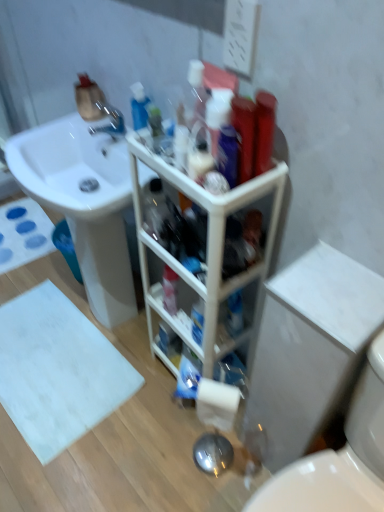
Measure the distance between white plastic cabinet at center and camera.

88.83 centimeters.

This screenshot has width=384, height=512. I want to click on white glossy toilet at lower right, so point(339,458).

At what (x,y) coordinates should I click in order to perform the action: click on white matte toilet paper at lower center. Please return your answer as a coordinate pair (x, y). The image size is (384, 512). Looking at the image, I should click on (217, 403).

This screenshot has width=384, height=512. Describe the element at coordinates (23, 234) in the screenshot. I see `white matte bath mat at lower left, which appears as the second bath mat when viewed from the front` at that location.

Find the location of a particular element. This screenshot has height=512, width=384. white plastic cabinet at center is located at coordinates (206, 255).

In the scene shown: Considering the relative sizes of white glossy toilet at lower right and white glossy sink at upper left in the image provided, is white glossy toilet at lower right smaller than white glossy sink at upper left?

Yes, white glossy toilet at lower right is smaller than white glossy sink at upper left.

How distant is white glossy toilet at lower right from white glossy sink at upper left?

white glossy toilet at lower right is 36.70 inches from white glossy sink at upper left.

From a real-world perspective, is white glossy toilet at lower right physically below white glossy sink at upper left?

Yes, from a real-world perspective, white glossy toilet at lower right is under white glossy sink at upper left.

Is white glossy toilet at lower right positioned with its back to white glossy sink at upper left?

No, white glossy toilet at lower right is not facing away from white glossy sink at upper left.

How different are the orientations of white glossy sink at upper left and metallic silver faucet at upper left in degrees?

The angular difference between white glossy sink at upper left and metallic silver faucet at upper left is 4.92 degrees.

This screenshot has height=512, width=384. What are the coordinates of `sink to the left of metallic silver faucet at upper left` in the screenshot? It's located at (83, 203).

From a real-world perspective, does white glossy sink at upper left stand above metallic silver faucet at upper left?

Actually, white glossy sink at upper left is physically below metallic silver faucet at upper left in the real world.

Would you say white glossy sink at upper left is inside or outside metallic silver faucet at upper left?

white glossy sink at upper left is located beyond the bounds of metallic silver faucet at upper left.

Is white matte toilet paper at lower center surrounding white glossy sink at upper left?

No, white matte toilet paper at lower center does not contain white glossy sink at upper left.

Which of these two, white matte toilet paper at lower center or white glossy sink at upper left, stands taller?

white glossy sink at upper left.

From a real-world perspective, which is physically above, white matte toilet paper at lower center or white glossy sink at upper left?

white matte toilet paper at lower center is physically above.

Is white matte toilet paper at lower center at the left side of white glossy sink at upper left?

No, white matte toilet paper at lower center is not to the left of white glossy sink at upper left.

From a real-world perspective, is white glossy toilet at lower right on white plastic cabinet at center?

No.

Considering the relative sizes of white glossy toilet at lower right and white plastic cabinet at center in the image provided, is white glossy toilet at lower right taller than white plastic cabinet at center?

In fact, white glossy toilet at lower right may be shorter than white plastic cabinet at center.

Is white glossy toilet at lower right inside or outside of white plastic cabinet at center?

white glossy toilet at lower right exists outside the volume of white plastic cabinet at center.

Does white glossy toilet at lower right have a lesser width compared to white plastic cabinet at center?

No, white glossy toilet at lower right is not thinner than white plastic cabinet at center.

Is white matte bath mat at lower left, which is the 1th bath mat in back-to-front order, with white plastic cabinet at center?

No, white matte bath mat at lower left, which is the 1th bath mat in back-to-front order, is not with white plastic cabinet at center.

Is white matte bath mat at lower left, which appears as the second bath mat when viewed from the front, turned away from white plastic cabinet at center?

No, white matte bath mat at lower left, which appears as the second bath mat when viewed from the front, is not facing away from white plastic cabinet at center.

Who is shorter, white matte bath mat at lower left, which is the first bath mat from top to bottom, or white plastic cabinet at center?

Standing shorter between the two is white matte bath mat at lower left, which is the first bath mat from top to bottom.

From the image's perspective, is white glossy toilet at lower right positioned above or below metallic silver faucet at upper left?

Clearly, from the image's perspective, white glossy toilet at lower right is below metallic silver faucet at upper left.

Is white glossy toilet at lower right oriented away from metallic silver faucet at upper left?

white glossy toilet at lower right is not turned away from metallic silver faucet at upper left.

Can you confirm if white glossy toilet at lower right is shorter than metallic silver faucet at upper left?

Incorrect, the height of white glossy toilet at lower right does not fall short of that of metallic silver faucet at upper left.

In the scene shown: Can you confirm if white plastic cabinet at center is bigger than white matte bath mat at lower left, which is the 1th bath mat in back-to-front order?

Yes, white plastic cabinet at center is bigger than white matte bath mat at lower left, which is the 1th bath mat in back-to-front order.

Considering the relative positions of white plastic cabinet at center and white matte bath mat at lower left, which is the 1th bath mat in back-to-front order, in the image provided, is white plastic cabinet at center to the left of white matte bath mat at lower left, which is the 1th bath mat in back-to-front order, from the viewer's perspective?

Incorrect, white plastic cabinet at center is not on the left side of white matte bath mat at lower left, which is the 1th bath mat in back-to-front order.

From a real-world perspective, is white plastic cabinet at center beneath white matte bath mat at lower left, acting as the second bath mat starting from the bottom?

Actually, white plastic cabinet at center is physically above white matte bath mat at lower left, acting as the second bath mat starting from the bottom, in the real world.

Image resolution: width=384 pixels, height=512 pixels. I want to click on bathroom cabinet in front of the white matte bath mat at lower left, acting as the second bath mat starting from the bottom, so click(206, 255).

Identify the location of sink lying above the white glossy toilet at lower right (from the image's perspective). The image size is (384, 512). (83, 203).

Where is `tap that appears above the white glossy sink at upper left (from a real-world perspective)`? tap that appears above the white glossy sink at upper left (from a real-world perspective) is located at coordinates (108, 121).

Considering their positions, is white matte bath mat at lower left, the 1th bath mat viewed from the front, positioned closer to white glossy toilet at lower right than white matte bath mat at lower left, which is the first bath mat from top to bottom?

white matte bath mat at lower left, the 1th bath mat viewed from the front, is positioned closer to the anchor white glossy toilet at lower right.

Considering their positions, is white matte bath mat at lower left, which is the first bath mat from top to bottom, positioned further to white glossy toilet at lower right than white glossy sink at upper left?

white matte bath mat at lower left, which is the first bath mat from top to bottom, is further to white glossy toilet at lower right.

Considering their positions, is white matte bath mat at lower left, which is the 1th bath mat in bottom-to-top order, positioned further to white glossy sink at upper left than white glossy toilet at lower right?

white glossy toilet at lower right is positioned further to the anchor white glossy sink at upper left.

When comparing their distances from metallic silver faucet at upper left, does white glossy sink at upper left or white matte bath mat at lower left, which is the first bath mat from top to bottom, seem further?

white matte bath mat at lower left, which is the first bath mat from top to bottom, is positioned further to the anchor metallic silver faucet at upper left.

Which object lies further to the anchor point white matte toilet paper at lower center, white glossy toilet at lower right or white glossy sink at upper left?

white glossy sink at upper left is positioned further to the anchor white matte toilet paper at lower center.

Based on their spatial positions, is white glossy toilet at lower right or white matte bath mat at lower left, which appears as the second bath mat when viewed from the front, closer to white glossy sink at upper left?

Among the two, white matte bath mat at lower left, which appears as the second bath mat when viewed from the front, is located nearer to white glossy sink at upper left.

Based on their spatial positions, is white glossy sink at upper left or metallic silver faucet at upper left further from white plastic cabinet at center?

metallic silver faucet at upper left is positioned further to the anchor white plastic cabinet at center.

When comparing their distances from white plastic cabinet at center, does white glossy toilet at lower right or metallic silver faucet at upper left seem closer?

Based on the image, white glossy toilet at lower right appears to be nearer to white plastic cabinet at center.

Where is `bath mat located between white glossy toilet at lower right and white matte bath mat at lower left, which appears as the second bath mat when viewed from the front, in the depth direction`? This screenshot has height=512, width=384. bath mat located between white glossy toilet at lower right and white matte bath mat at lower left, which appears as the second bath mat when viewed from the front, in the depth direction is located at coordinates point(58,371).

Identify the location of bathroom cabinet between white glossy toilet at lower right and white matte bath mat at lower left, which is the 1th bath mat in back-to-front order, in the front-back direction. This screenshot has height=512, width=384. (206, 255).

Locate an element on the screen. The width and height of the screenshot is (384, 512). tap between white glossy toilet at lower right and white matte bath mat at lower left, which is the 1th bath mat in back-to-front order, along the z-axis is located at coordinates (108, 121).

At what (x,y) coordinates should I click in order to perform the action: click on toilet paper between white glossy sink at upper left and white glossy toilet at lower right. Please return your answer as a coordinate pair (x, y). The width and height of the screenshot is (384, 512). Looking at the image, I should click on (217, 403).